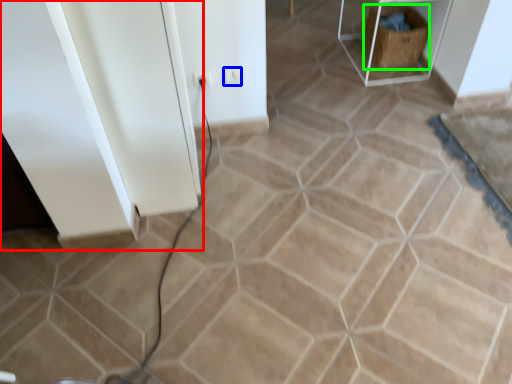
Question: Estimate the real-world distances between objects in this image. Which object is closer to cabinetry (highlighted by a red box), electric outlet (highlighted by a blue box) or crate (highlighted by a green box)?

Choices:
 (A) electric outlet
 (B) crate

Answer: (A)